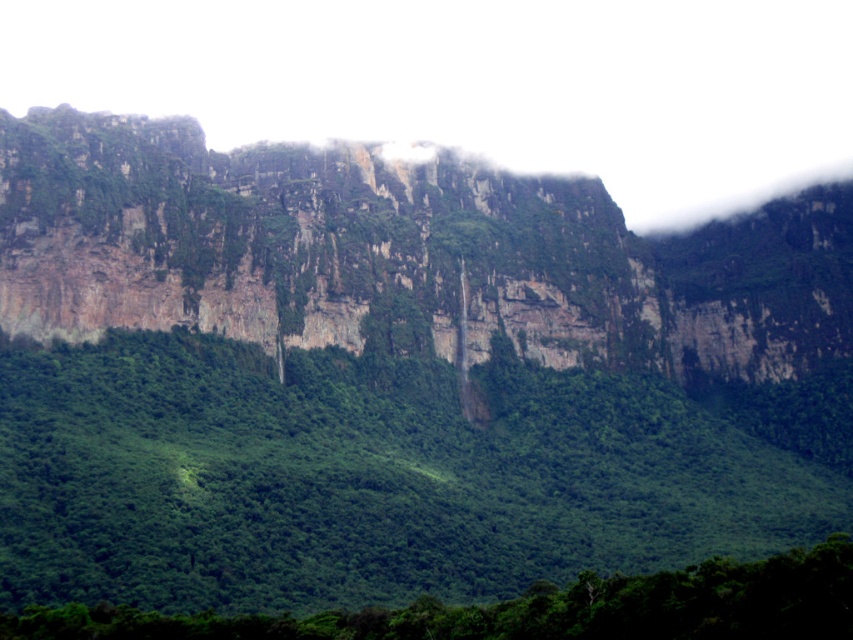
You are a hiker who wants to take a photo of the green leafy vegetation at center. Where exactly should you aim your camera to capture it?

The green leafy vegetation at center is located at point coordinates of [386,474]. So you should aim your camera at that coordinate point to capture it.

You are a hiker who wants to reach the highest peak in the mountain range. You see two points marked on your map, point 1 at coordinates point (74, 400) and point 2 at coordinates point (421, 605). According to the image, which point is closer to the base of the cliffs?

Point (421, 605) is closer to the base of the cliffs because it is in front of point (74, 400), which is further back.

You are a hiker standing at the base of the cliffs. You notice green leafy vegetation at center in the image. Based on its position, can you estimate how far it is from the base of the cliffs?

The green leafy vegetation at center is located at coordinates point (386,474). Since the y coordinate is 0.454, which is closer to the base of the cliffs, it is approximately 45.4 percent of the distance from the base to the top of the cliffs. Therefore, it is relatively close to the base.